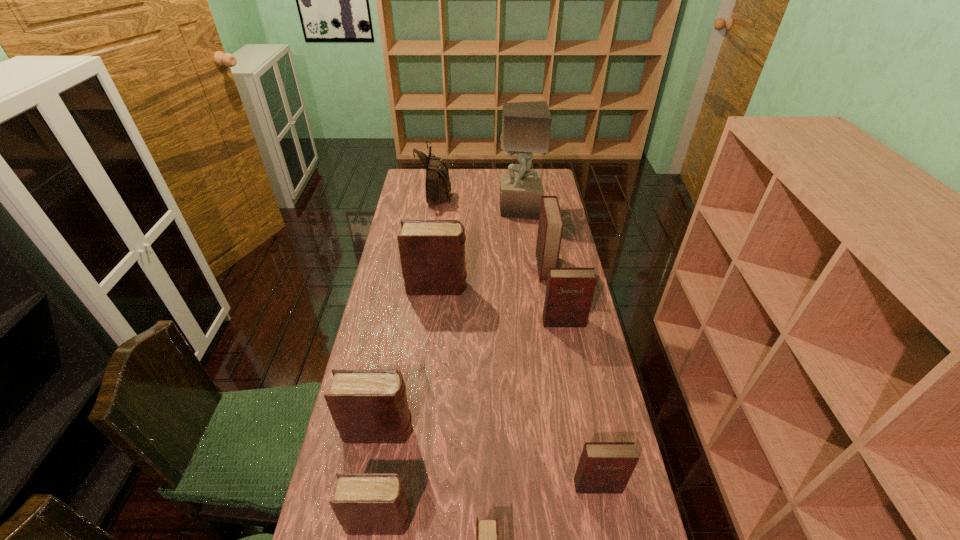
Where is `the second smallest brown diary`? This screenshot has width=960, height=540. the second smallest brown diary is located at coordinates (365, 504).

Where is `the smallest reddish-brown diary`? Image resolution: width=960 pixels, height=540 pixels. the smallest reddish-brown diary is located at coordinates (604, 467).

At what (x,y) coordinates should I click in order to perform the action: click on the nearest reddish-brown diary. Please return your answer as a coordinate pair (x, y). Looking at the image, I should click on (604, 467).

Where is `vacant space situated on the front-facing side of the tallest object`? The image size is (960, 540). vacant space situated on the front-facing side of the tallest object is located at coordinates (411, 208).

Where is `free space located 0.290m on the front-facing side of the tallest object`? free space located 0.290m on the front-facing side of the tallest object is located at coordinates tap(435, 208).

Locate an element on the screen. The height and width of the screenshot is (540, 960). vacant region located on the front-facing side of the tallest object is located at coordinates (414, 208).

This screenshot has width=960, height=540. Identify the location of vacant space situated on the front-facing side of the shoulder bag. (498, 194).

Locate an element on the screen. free space located on the front cover of the biggest reddish-brown diary is located at coordinates (458, 267).

Where is `free space located 0.370m on the front cover of the biggest reddish-brown diary`? free space located 0.370m on the front cover of the biggest reddish-brown diary is located at coordinates (443, 267).

This screenshot has height=540, width=960. I want to click on free space located on the front cover of the biggest reddish-brown diary, so click(453, 267).